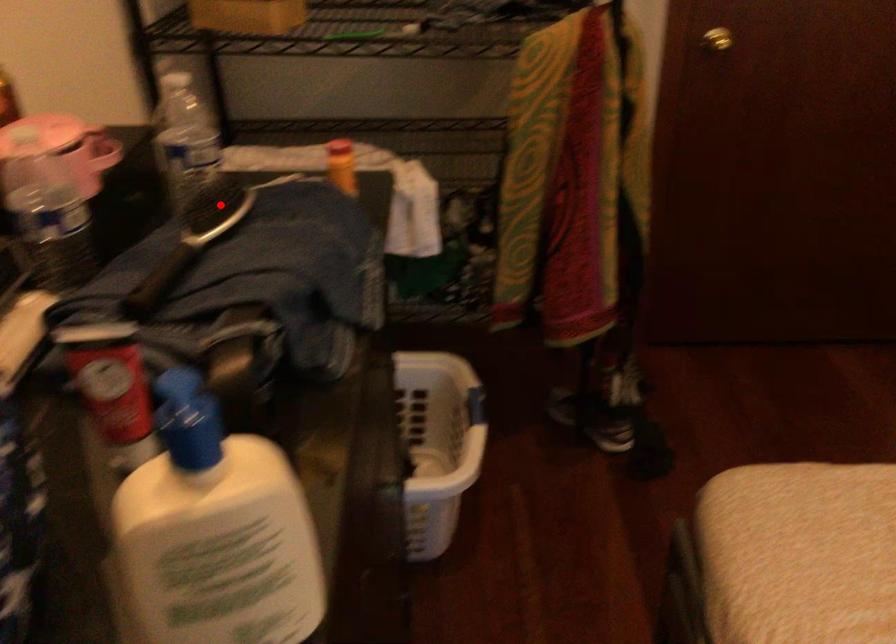
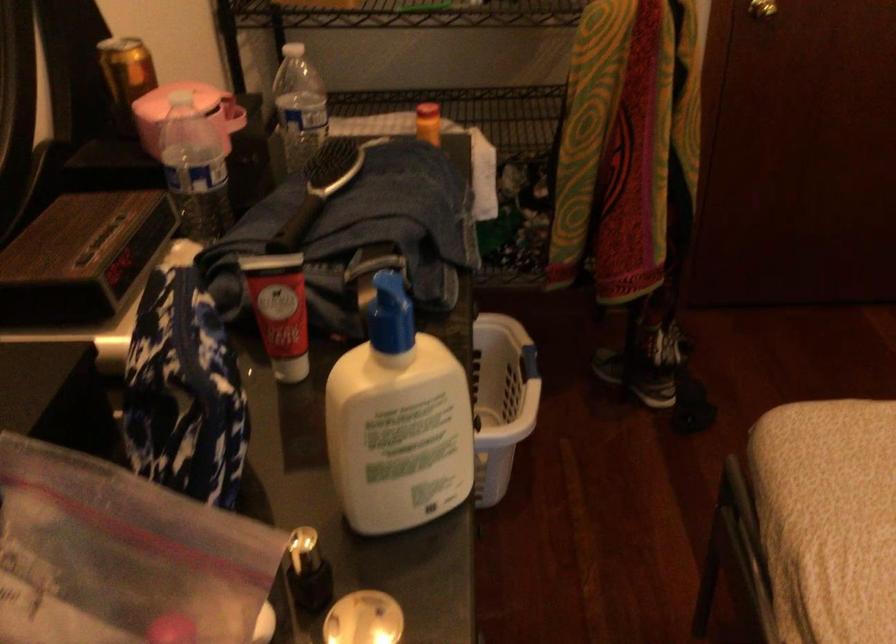
Question: I am providing you with two images of the same scene from different viewpoints. A red point is shown in image1. For the corresponding object point in image2, is it positioned nearer or farther from the camera?

Choices:
 (A) Nearer
 (B) Farther

Answer: (B)